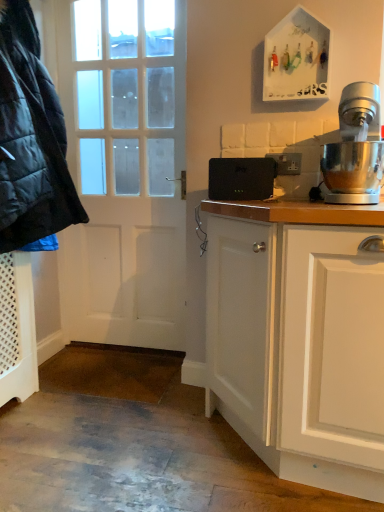
Question: Is point (374, 195) positioned closer to the camera than point (248, 190)?

Choices:
 (A) farther
 (B) closer

Answer: (B)

Question: Considering the positions of polished stainless steel stand mixer at right and black plastic router at center in the image, is polished stainless steel stand mixer at right bigger or smaller than black plastic router at center?

Choices:
 (A) big
 (B) small

Answer: (A)

Question: Which of these objects is positioned closest to the matte black jacket at left?

Choices:
 (A) white matte door at left
 (B) black plastic router at center
 (C) polished stainless steel stand mixer at right

Answer: (A)

Question: Which object is the closest to the white matte door at left?

Choices:
 (A) black plastic router at center
 (B) polished stainless steel stand mixer at right
 (C) matte black jacket at left

Answer: (C)